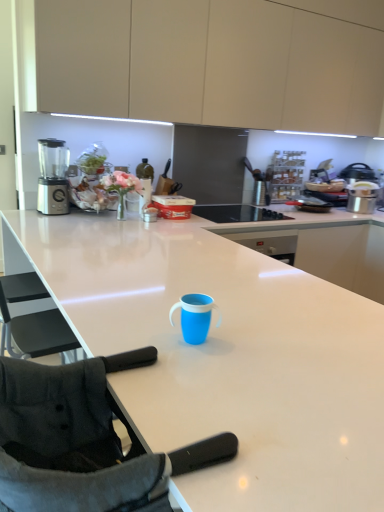
Identify the location of free point behind blue plastic sippy cup at center. The height and width of the screenshot is (512, 384). (178, 310).